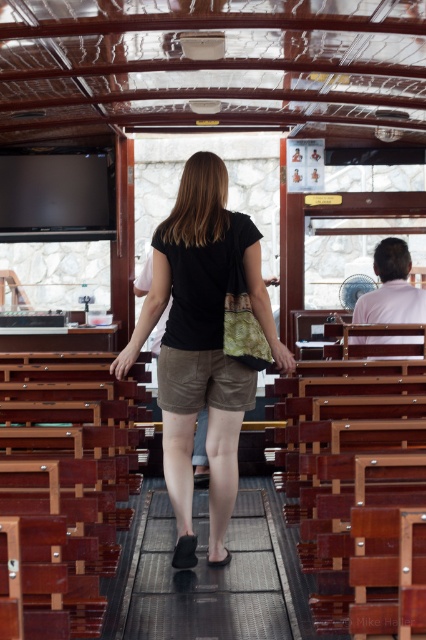
Who is higher up, black matte shorts at center or black rubber mat at center?

Positioned higher is black matte shorts at center.

Who is more forward, (242, 241) or (158, 572)?

Positioned in front is point (242, 241).

Find the location of a particular element. Image resolution: width=426 pixels, height=640 pixels. black matte shorts at center is located at coordinates (201, 346).

Image resolution: width=426 pixels, height=640 pixels. Find the location of `black matte shorts at center`. black matte shorts at center is located at coordinates (201, 346).